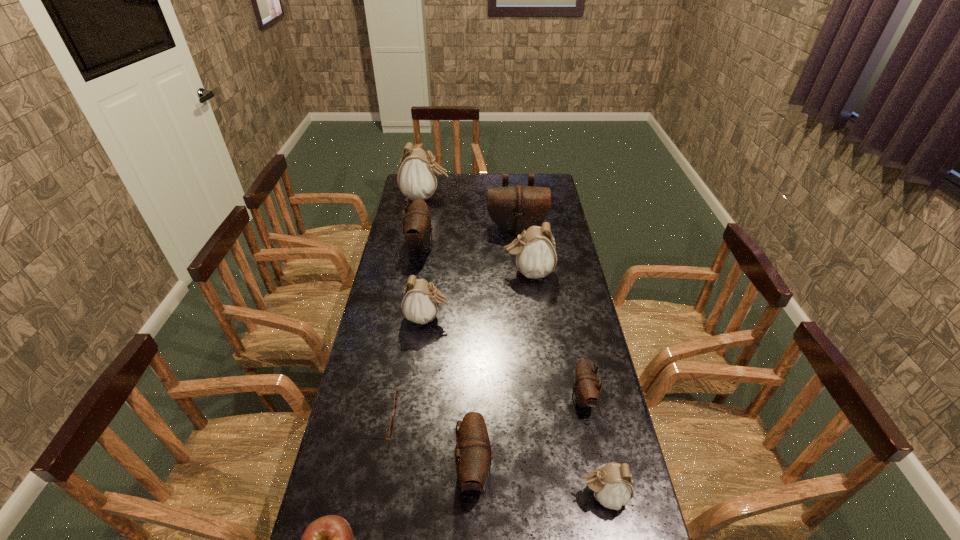
Where is `vacant space at the far edge of the desktop`? Image resolution: width=960 pixels, height=540 pixels. vacant space at the far edge of the desktop is located at coordinates (512, 179).

In the image, there is a desktop. At what (x,y) coordinates should I click in order to perform the action: click on vacant space at the left edge. Please return your answer as a coordinate pair (x, y). Looking at the image, I should click on (394, 245).

You are a GUI agent. You are given a task and a screenshot of the screen. Output one action in this format:
    pyautogui.click(x=<x>, y=<y>)
    Task: Click on the vacant space at the right edge of the desktop
    
    Given the screenshot: What is the action you would take?
    pyautogui.click(x=558, y=268)

Locate an element on the screen. The width and height of the screenshot is (960, 540). free space between the third biggest brown pouch and the biggest brown pouch is located at coordinates (495, 348).

This screenshot has height=540, width=960. What are the coordinates of `unoccupied position between the leftmost brown pouch and the biggest brown pouch` in the screenshot? It's located at (468, 237).

You are a GUI agent. You are given a task and a screenshot of the screen. Output one action in this format:
    pyautogui.click(x=<x>, y=<y>)
    Task: Click on the vacant area that lies between the biggest brown pouch and the nearest white pouch
    The width and height of the screenshot is (960, 540).
    Given the screenshot: What is the action you would take?
    pyautogui.click(x=560, y=361)

You are a GUI agent. You are given a task and a screenshot of the screen. Output one action in this format:
    pyautogui.click(x=<x>, y=<y>)
    Task: Click on the vacant region between the shortest object and the third biggest brown pouch
    This screenshot has height=540, width=960.
    Given the screenshot: What is the action you would take?
    pyautogui.click(x=424, y=443)

This screenshot has height=540, width=960. I want to click on empty space between the nearest white pouch and the biggest brown pouch, so click(x=560, y=361).

Locate an element on the screen. the fourth closest object to the farthest white pouch is located at coordinates (420, 302).

The image size is (960, 540). Find the location of `object that stands as the second closest to the biggest brown pouch`. object that stands as the second closest to the biggest brown pouch is located at coordinates (417, 177).